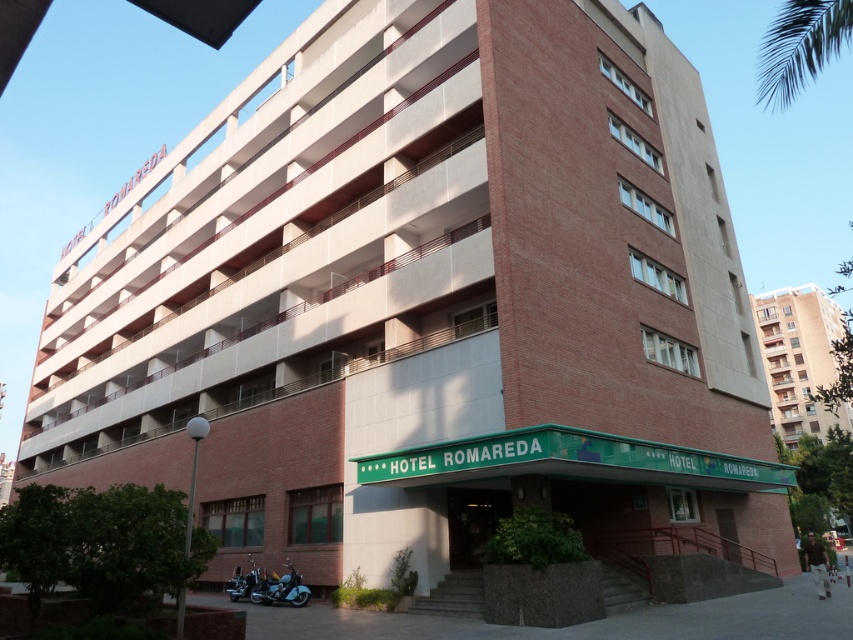
Is shiny chrome motorcycle at lower center smaller than shiny chrome motorcycle at lower left?

No, shiny chrome motorcycle at lower center is not smaller than shiny chrome motorcycle at lower left.

Identify the location of shiny chrome motorcycle at lower center. (280, 588).

Does point (788, 362) lie in front of point (833, 8)?

No, (788, 362) is behind (833, 8).

Does point (801, 324) come in front of point (799, 10)?

That is False.

Identify the location of brown brick building at right. (799, 358).

Is green leafy palm tree at upper right bigger than shiny chrome motorcycle at lower center?

Yes, green leafy palm tree at upper right is bigger than shiny chrome motorcycle at lower center.

Does green leafy palm tree at upper right lie in front of shiny chrome motorcycle at lower center?

That is True.

The width and height of the screenshot is (853, 640). Identify the location of green leafy palm tree at upper right. (799, 45).

Identify the location of green leafy palm tree at upper right. Image resolution: width=853 pixels, height=640 pixels. (799, 45).